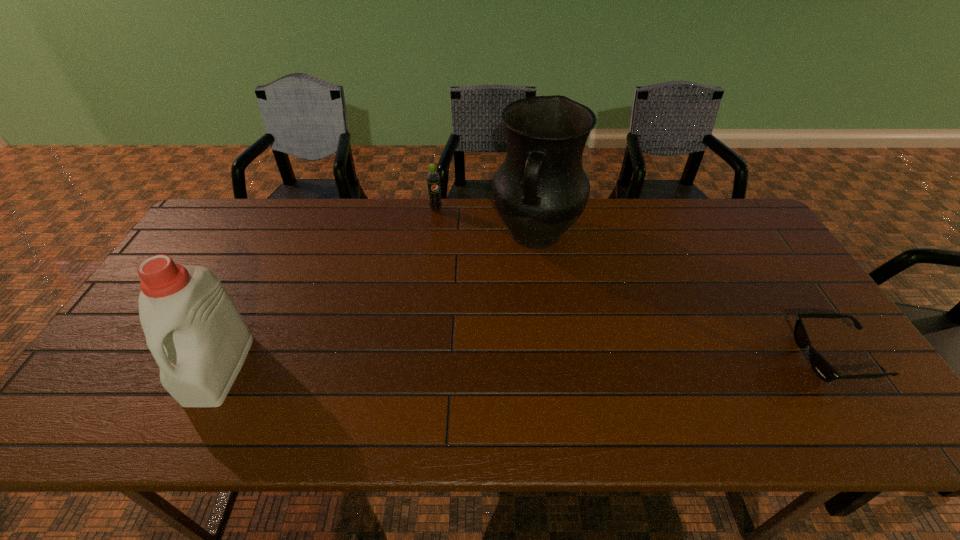
Where is `vacant area between the tallest object and the third tallest object`? The height and width of the screenshot is (540, 960). vacant area between the tallest object and the third tallest object is located at coordinates 486,222.

The height and width of the screenshot is (540, 960). I want to click on vacant space that is in between the third object from right to left and the sunglasses, so click(636, 283).

Where is `vacant space in between the third tallest object and the leftmost object`? vacant space in between the third tallest object and the leftmost object is located at coordinates (327, 289).

Where is `free space between the pitcher and the sunglasses`? The width and height of the screenshot is (960, 540). free space between the pitcher and the sunglasses is located at coordinates (685, 296).

Where is `unoccupied position between the third shortest object and the tallest object`? unoccupied position between the third shortest object and the tallest object is located at coordinates [x=377, y=302].

Where is `free point between the third tallest object and the leftmost object`? This screenshot has width=960, height=540. free point between the third tallest object and the leftmost object is located at coordinates (327, 289).

This screenshot has height=540, width=960. In order to click on blank region between the rightmost object and the leftmost object in this screenshot , I will do `click(527, 363)`.

Locate an element on the screen. free spot between the leftmost object and the rightmost object is located at coordinates (527, 363).

The width and height of the screenshot is (960, 540). Identify the location of object that is the third closest to the third tallest object. (818, 363).

Where is `object that is the third nearest to the second tallest object`? object that is the third nearest to the second tallest object is located at coordinates (818, 363).